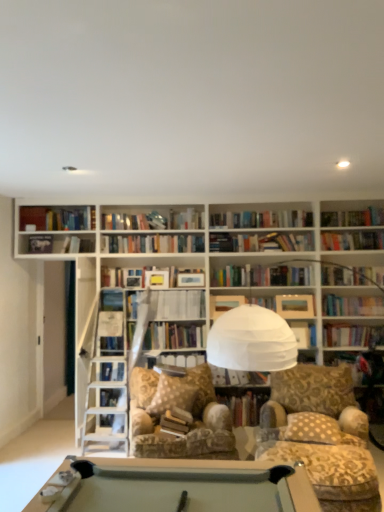
Question: Is hardcover book at upper left, the first paperback book from the left, with hardcover book at center, arranged as the third paperback book when ordered from the bottom?

Choices:
 (A) yes
 (B) no

Answer: (B)

Question: Is hardcover book at upper left, positioned as the fifth paperback book in right-to-left order, oriented away from hardcover book at center, arranged as the 3th paperback book when viewed from the top?

Choices:
 (A) yes
 (B) no

Answer: (B)

Question: Are hardcover book at upper left, the first paperback book from the left, and hardcover book at center, which is the fourth paperback book in left-to-right order, located far from each other?

Choices:
 (A) yes
 (B) no

Answer: (A)

Question: Is hardcover book at center, arranged as the third paperback book when ordered from the bottom, located within hardcover book at upper left, the first paperback book from the left?

Choices:
 (A) yes
 (B) no

Answer: (B)

Question: Is hardcover book at upper left, the first paperback book from the left, outside hardcover book at center, which is the fourth paperback book in left-to-right order?

Choices:
 (A) yes
 (B) no

Answer: (A)

Question: Is point (200, 221) positioned closer to the camera than point (178, 278)?

Choices:
 (A) closer
 (B) farther

Answer: (B)

Question: From the image's perspective, is hardcover book at center, marked as the 3th book in a bottom-to-top arrangement, located above or below hardcover book at center, arranged as the 3th paperback book when viewed from the top?

Choices:
 (A) above
 (B) below

Answer: (A)

Question: Is hardcover book at center, placed as the second book when sorted from left to right, spatially inside hardcover book at center, arranged as the third paperback book when ordered from the bottom, or outside of it?

Choices:
 (A) inside
 (B) outside

Answer: (B)

Question: Considering the positions of hardcover book at center, placed as the second book when sorted from left to right, and hardcover book at center, arranged as the 3th paperback book when viewed from the top, in the image, is hardcover book at center, placed as the second book when sorted from left to right, taller or shorter than hardcover book at center, arranged as the 3th paperback book when viewed from the top,?

Choices:
 (A) tall
 (B) short

Answer: (A)

Question: From the image's perspective, is hardcover book at center, arranged as the 3th paperback book when viewed from the top, above or below hardcover book at center, placed as the second book when sorted from left to right?

Choices:
 (A) above
 (B) below

Answer: (B)

Question: In terms of width, does hardcover book at center, arranged as the 3th paperback book when viewed from the top, look wider or thinner when compared to hardcover book at center, placed as the second book when sorted from left to right?

Choices:
 (A) thin
 (B) wide

Answer: (A)

Question: Do you think hardcover book at center, which is the fourth paperback book in left-to-right order, is within hardcover book at center, marked as the 2th book in a right-to-left arrangement, or outside of it?

Choices:
 (A) outside
 (B) inside

Answer: (A)

Question: In terms of height, does hardcover book at center, arranged as the 3th paperback book when viewed from the top, look taller or shorter compared to hardcover book at center, placed as the second book when sorted from left to right?

Choices:
 (A) tall
 (B) short

Answer: (B)

Question: From a real-world perspective, is beige dotted pillow at center physically located above or below hardcover book at center, the 3th book from the left?

Choices:
 (A) above
 (B) below

Answer: (A)

Question: Visually, is beige dotted pillow at center positioned to the left or to the right of hardcover book at center, the third book from the top?

Choices:
 (A) left
 (B) right

Answer: (B)